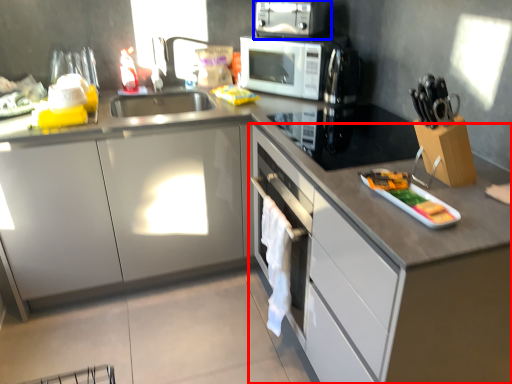
Question: Which object appears farthest to the camera in this image, cabinetry (highlighted by a red box) or kitchen appliance (highlighted by a blue box)?

Choices:
 (A) cabinetry
 (B) kitchen appliance

Answer: (B)